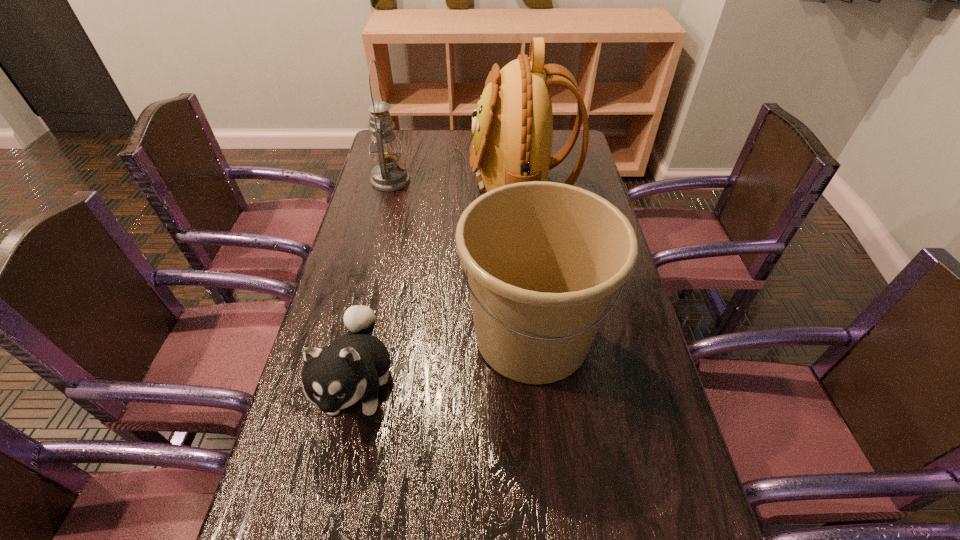
You are a GUI agent. You are given a task and a screenshot of the screen. Output one action in this format:
    pyautogui.click(x=<x>, y=<y>)
    Task: Click on the object situated at the far edge
    This screenshot has height=540, width=960.
    Given the screenshot: What is the action you would take?
    512,128

The height and width of the screenshot is (540, 960). Find the location of `oil lamp that is at the left edge`. oil lamp that is at the left edge is located at coordinates (389, 175).

The width and height of the screenshot is (960, 540). Identify the location of puppy that is at the left edge. (353, 366).

Locate an element on the screen. The height and width of the screenshot is (540, 960). backpack located at the right edge is located at coordinates (512, 128).

You are a GUI agent. You are given a task and a screenshot of the screen. Output one action in this format:
    pyautogui.click(x=<x>, y=<y>)
    Task: Click on the bucket at the right edge
    
    Given the screenshot: What is the action you would take?
    click(x=543, y=259)

The height and width of the screenshot is (540, 960). In order to click on object at the far right corner in this screenshot , I will do `click(512, 128)`.

The image size is (960, 540). In order to click on vacant space at the far edge in this screenshot , I will do `click(444, 136)`.

In the image, there is a desktop. In order to click on blank space at the left edge in this screenshot , I will do `click(349, 497)`.

This screenshot has width=960, height=540. Find the location of `free space at the right edge of the desktop`. free space at the right edge of the desktop is located at coordinates (627, 451).

Find the location of `free space that is in between the oil lamp and the tallest object`. free space that is in between the oil lamp and the tallest object is located at coordinates (456, 184).